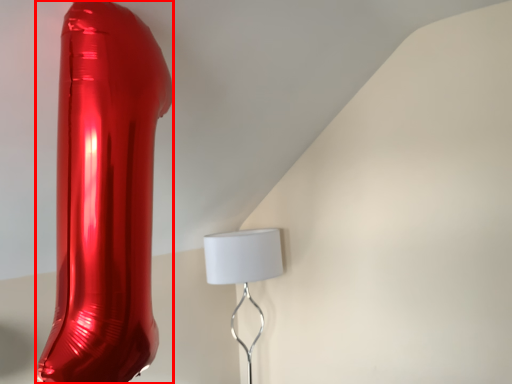
Question: Observing the image, what is the correct spatial positioning of glass vase (annotated by the red box) in reference to lamp?

Choices:
 (A) right
 (B) left

Answer: (B)